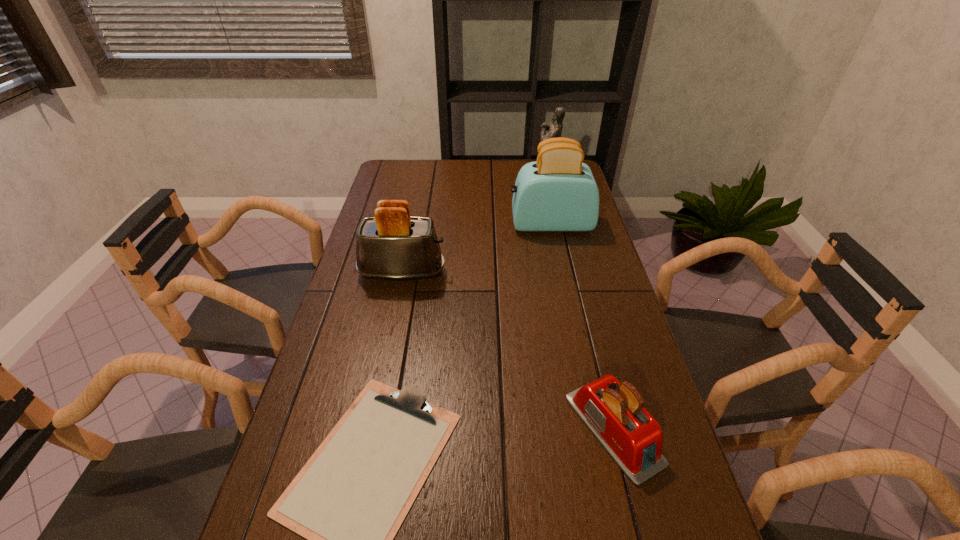
I want to click on the fourth closest object to the shortest object, so [x=554, y=129].

Locate an element on the screen. toaster that is the third nearest to the shortest object is located at coordinates (558, 192).

Image resolution: width=960 pixels, height=540 pixels. Find the location of `toaster that is the nearest to the figurine`. toaster that is the nearest to the figurine is located at coordinates (558, 192).

The image size is (960, 540). Find the location of `vacant space that satisfies the following two spatial constraints: 1. on the back side of the nearest toaster; 2. on the front-facing side of the figurine`. vacant space that satisfies the following two spatial constraints: 1. on the back side of the nearest toaster; 2. on the front-facing side of the figurine is located at coordinates 551,179.

This screenshot has width=960, height=540. What are the coordinates of `free space that satisfies the following two spatial constraints: 1. on the side of the farthest toaster with the lever; 2. on the back side of the nearest toaster` in the screenshot? It's located at (594, 429).

What are the coordinates of `free space that satisfies the following two spatial constraints: 1. on the side of the nearest toaster with the lever; 2. on the left side of the farthest toaster` in the screenshot? It's located at (594, 429).